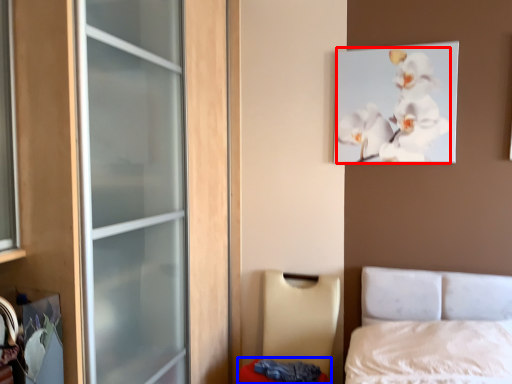
Question: Which of the following is the closest to the observer, flower (highlighted by a red box) or mattress (highlighted by a blue box)?

Choices:
 (A) flower
 (B) mattress

Answer: (B)